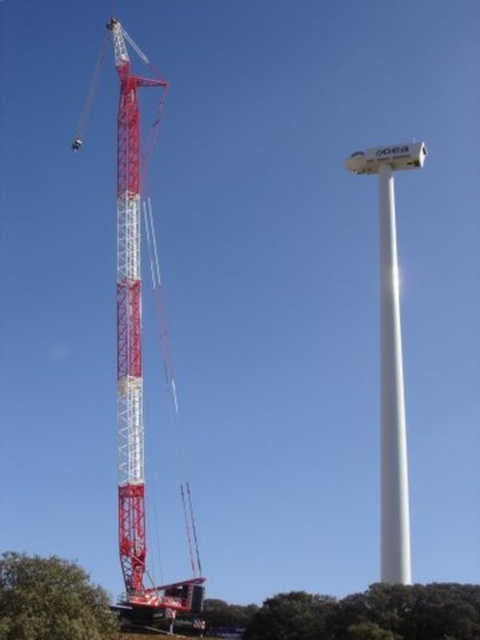
Question: Which object is the closest to the white smooth pole at right?

Choices:
 (A) green leafy tree at lower center
 (B) red painted metal tower crane at left
 (C) green leafy tree at lower left

Answer: (A)

Question: Which point is farther to the camera?

Choices:
 (A) coord(398,387)
 (B) coord(122,188)

Answer: (A)

Question: Can you confirm if red painted metal tower crane at left is smaller than green leafy tree at lower left?

Choices:
 (A) no
 (B) yes

Answer: (A)

Question: Among these objects, which one is nearest to the camera?

Choices:
 (A) green leafy tree at lower center
 (B) white smooth pole at right
 (C) red painted metal tower crane at left

Answer: (A)

Question: Can you confirm if red painted metal tower crane at left is thinner than green leafy tree at lower center?

Choices:
 (A) yes
 (B) no

Answer: (A)

Question: Can you confirm if green leafy tree at lower center is positioned below green leafy tree at lower left?

Choices:
 (A) no
 (B) yes

Answer: (B)